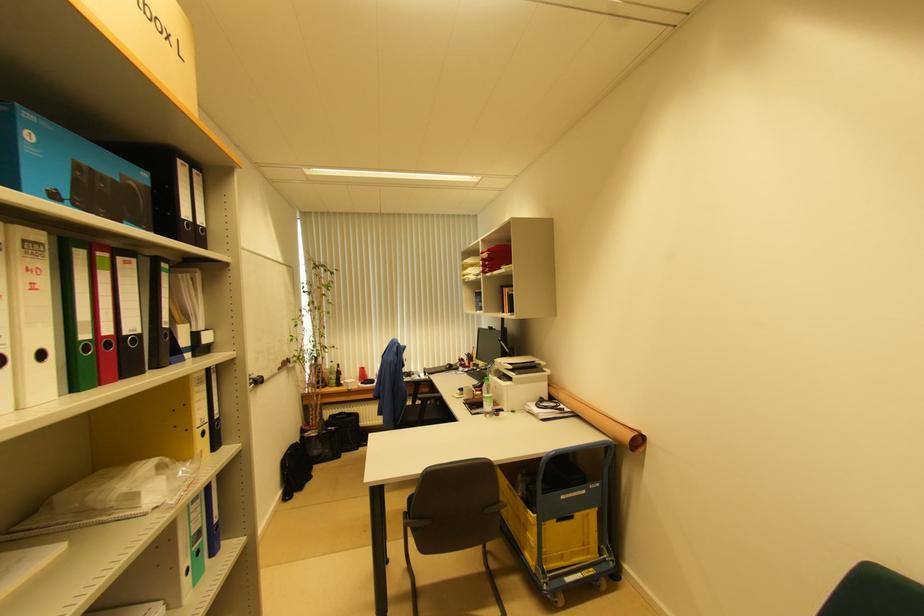
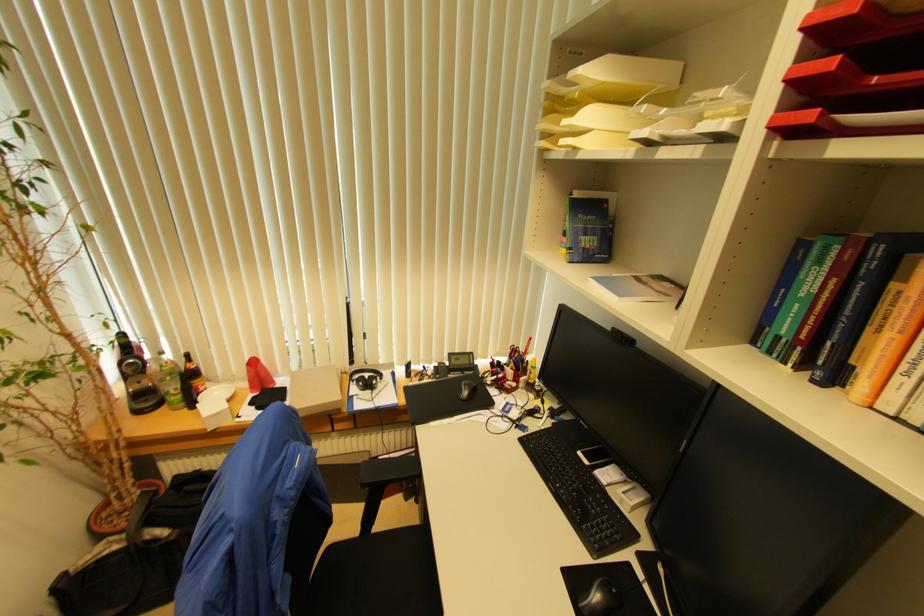
The point at (334, 381) is marked in the first image. Where is the corresponding point in the second image?

(174, 394)